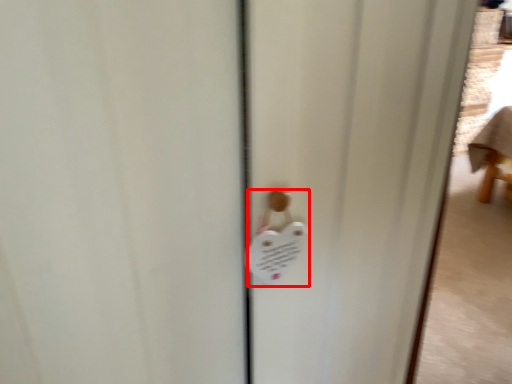
Question: From the image's perspective, considering the relative positions of lock (annotated by the red box) and screen door in the image provided, where is lock (annotated by the red box) located with respect to the staircase?

Choices:
 (A) above
 (B) below

Answer: (A)